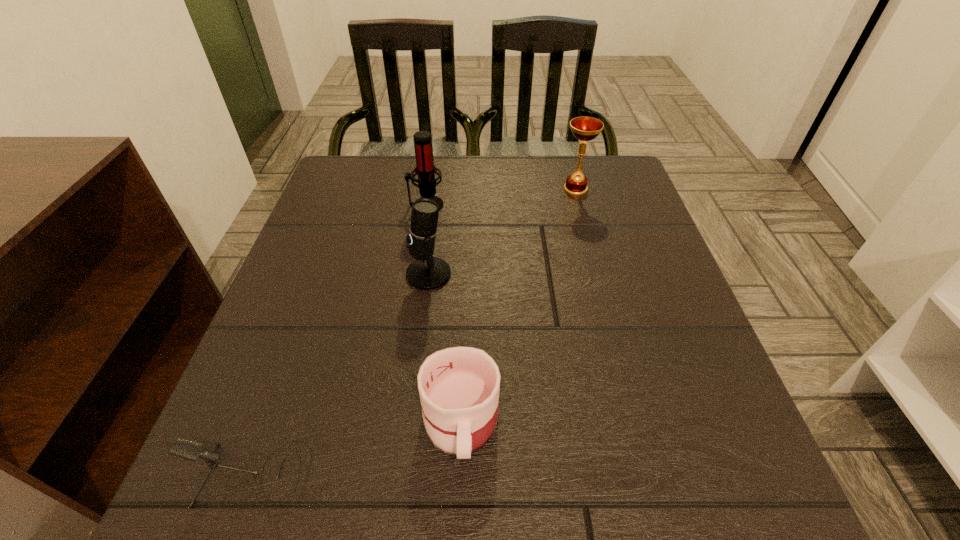
Identify the location of free space that is in between the shortest microphone and the second nearest microphone. The height and width of the screenshot is (540, 960). (341, 375).

Where is `vacant space in between the leftmost microphone and the chalice`? The width and height of the screenshot is (960, 540). vacant space in between the leftmost microphone and the chalice is located at coordinates (414, 333).

Identify the location of vacant space in between the rightmost object and the farthest microphone. (501, 197).

The image size is (960, 540). I want to click on empty space between the farthest microphone and the rightmost object, so click(x=501, y=197).

The width and height of the screenshot is (960, 540). In order to click on object that stands as the closest to the mug in this screenshot , I will do `click(191, 450)`.

The width and height of the screenshot is (960, 540). I want to click on object that is the fourth closest to the leftmost microphone, so click(x=583, y=128).

Locate which microphone is the second closest to the rightmost object. Please provide its 2D coordinates. Your answer should be formatted as a tuple, i.e. [(x, y)], where the tuple contains the x and y coordinates of a point satisfying the conditions above.

[(427, 272)]

Identify the location of microphone that is the closest to the mug. (191, 450).

Where is `blank space that satisfies the following two spatial constraints: 1. on the front side of the third nearest object; 2. on the left side of the farthest microphone`? Image resolution: width=960 pixels, height=540 pixels. blank space that satisfies the following two spatial constraints: 1. on the front side of the third nearest object; 2. on the left side of the farthest microphone is located at coordinates (416, 274).

This screenshot has height=540, width=960. What are the coordinates of `free space that satisfies the following two spatial constraints: 1. on the front side of the second nearest microphone; 2. on the stand of the shortest microphone` in the screenshot? It's located at (405, 476).